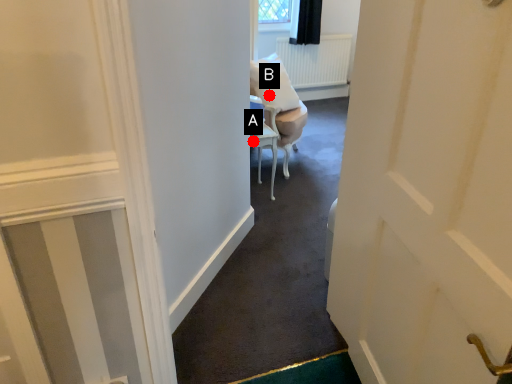
Question: Two points are circled on the image, labeled by A and B beside each circle. Which point is closer to the camera?

Choices:
 (A) A is closer
 (B) B is closer

Answer: (A)